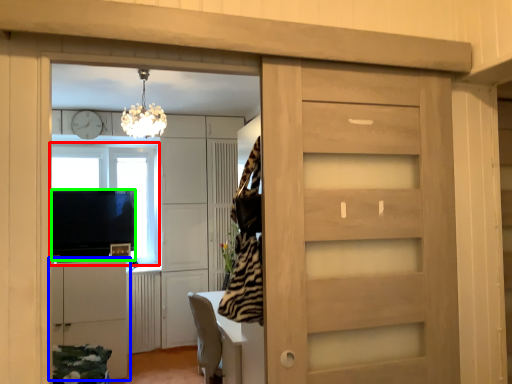
Question: Based on their relative distances, which object is nearer to window (highlighted by a red box)? Choose from cabinetry (highlighted by a blue box) and appliance (highlighted by a green box).

Choices:
 (A) cabinetry
 (B) appliance

Answer: (B)